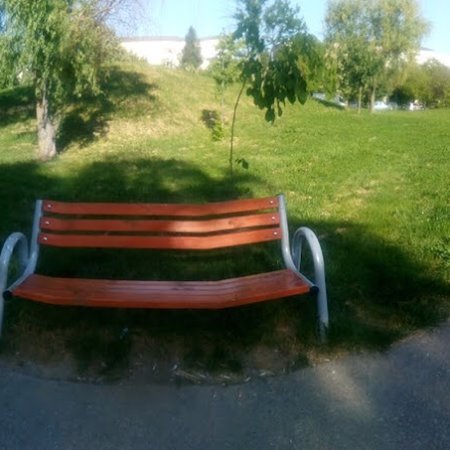
I want to click on the top of banch backrest, so click(164, 209).